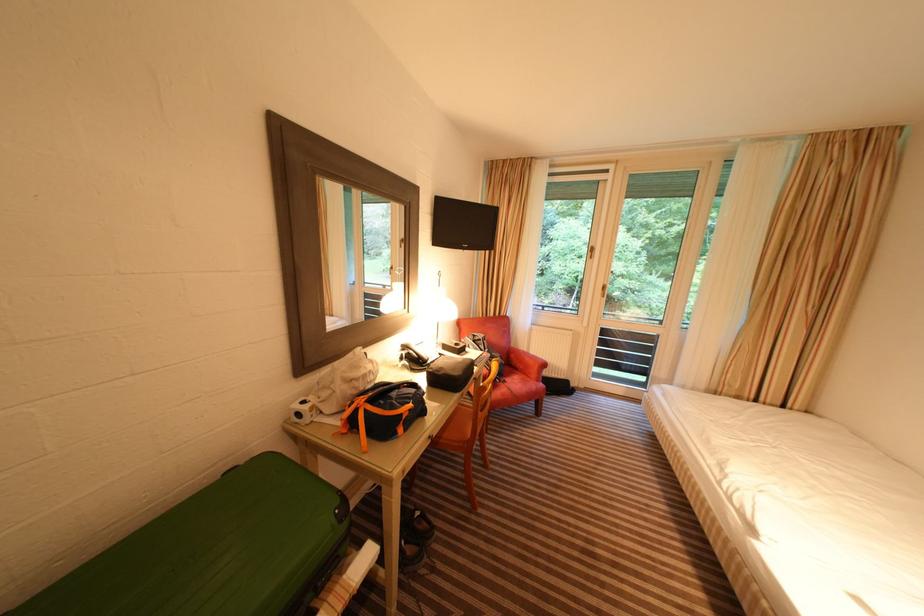
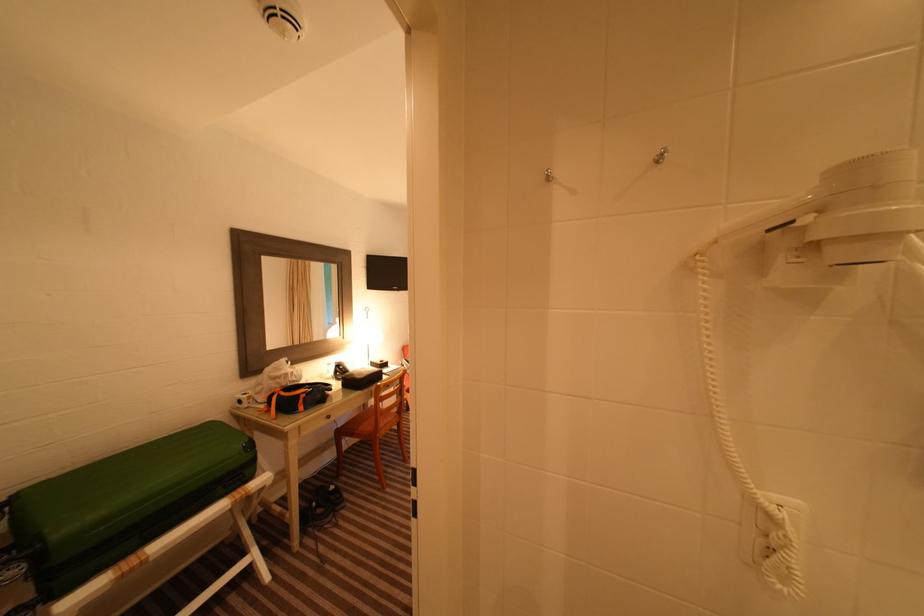
Question: Based on the continuous images, in which direction is the camera rotating? Reply with the corresponding letter.

Choices:
 (A) Left
 (B) Right
 (C) Up
 (D) Down

Answer: (C)